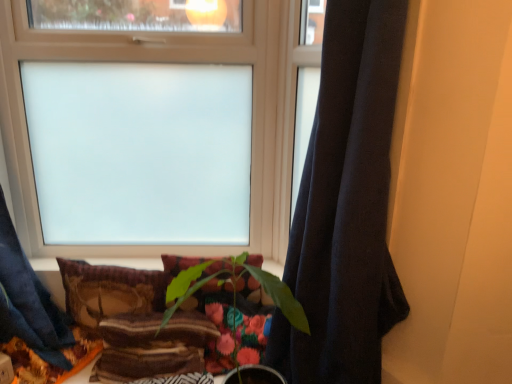
Question: Is frosted glass window at upper center turned away from velvet-like brown pillow at lower center, the 1th pillow viewed from the left?

Choices:
 (A) no
 (B) yes

Answer: (A)

Question: From a real-world perspective, does frosted glass window at upper center stand above velvet-like brown pillow at lower center, the 1th pillow viewed from the left?

Choices:
 (A) no
 (B) yes

Answer: (B)

Question: Does frosted glass window at upper center have a smaller size compared to velvet-like brown pillow at lower center, acting as the second pillow starting from the right?

Choices:
 (A) no
 (B) yes

Answer: (A)

Question: Is frosted glass window at upper center aimed at velvet-like brown pillow at lower center, the 1th pillow viewed from the left?

Choices:
 (A) yes
 (B) no

Answer: (A)

Question: Is frosted glass window at upper center completely or partially outside of velvet-like brown pillow at lower center, acting as the second pillow starting from the right?

Choices:
 (A) no
 (B) yes

Answer: (B)

Question: Are frosted glass window at upper center and velvet-like brown pillow at lower center, the 1th pillow viewed from the left, far apart?

Choices:
 (A) yes
 (B) no

Answer: (B)

Question: Considering the relative sizes of frosted glass window at upper center and dark blue fabric curtain at right in the image provided, is frosted glass window at upper center wider than dark blue fabric curtain at right?

Choices:
 (A) no
 (B) yes

Answer: (A)

Question: From a real-world perspective, is frosted glass window at upper center on dark blue fabric curtain at right?

Choices:
 (A) no
 (B) yes

Answer: (B)

Question: Does frosted glass window at upper center have a lesser height compared to dark blue fabric curtain at right?

Choices:
 (A) yes
 (B) no

Answer: (A)

Question: Does frosted glass window at upper center have a greater height compared to dark blue fabric curtain at right?

Choices:
 (A) yes
 (B) no

Answer: (B)

Question: Is frosted glass window at upper center turned away from dark blue fabric curtain at right?

Choices:
 (A) no
 (B) yes

Answer: (A)

Question: Is frosted glass window at upper center smaller than dark blue fabric curtain at right?

Choices:
 (A) no
 (B) yes

Answer: (B)

Question: Would you say green matte plant at center is outside velvet-like brown pillow at lower center, acting as the second pillow starting from the right?

Choices:
 (A) yes
 (B) no

Answer: (A)